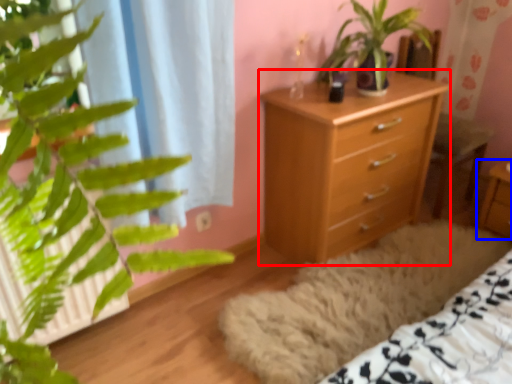
Question: Which object appears closest to the camera in this image, chest of drawers (highlighted by a red box) or nightstand (highlighted by a blue box)?

Choices:
 (A) chest of drawers
 (B) nightstand

Answer: (A)